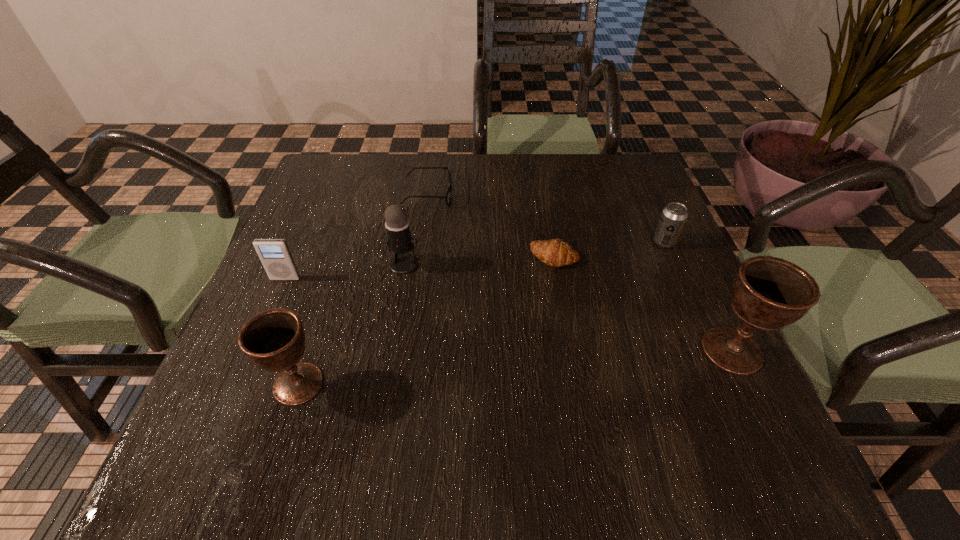
Find the location of `vacant spot for a new chalice to ensure equal spacing`. vacant spot for a new chalice to ensure equal spacing is located at coordinates (521, 366).